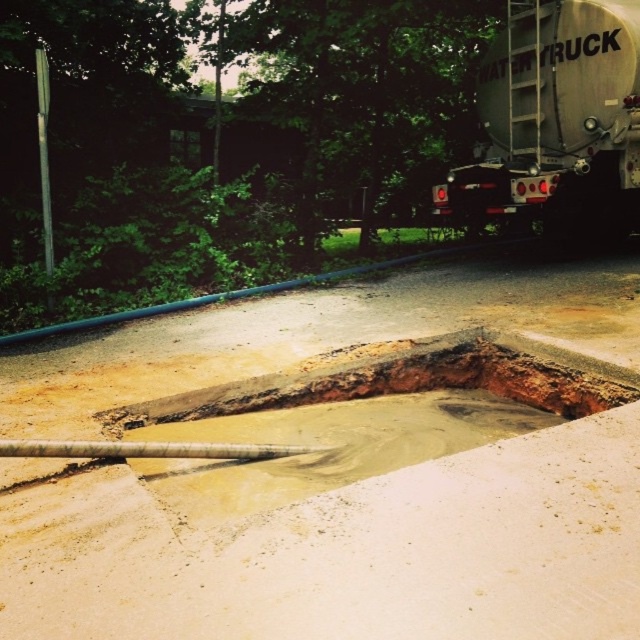
You are a construction worker standing near the large hole filled with liquid. You see the smooth concrete at center and the muddy concrete puddle at center. Which object is closer to you?

The smooth concrete at center is closer to the viewer than the muddy concrete puddle at center.

You are a construction worker who needs to transport the muddy concrete puddle at center to the silver metallic trailer truck at upper right. Given their sizes, can you fit the puddle into the truck without spilling?

The muddy concrete puddle at center is smaller than the silver metallic trailer truck at upper right, so yes, it can be transported without spilling as the truck has enough space to accommodate the puddle.